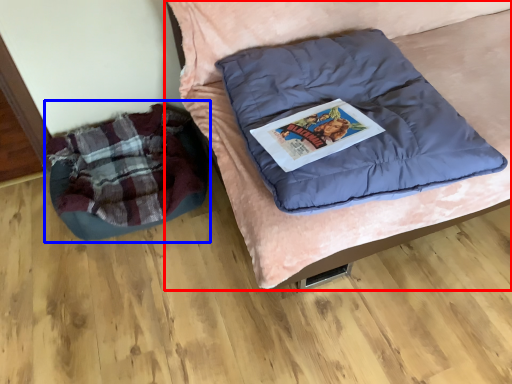
Question: Which object is further to the camera taking this photo, furniture (highlighted by a red box) or bean bag chair (highlighted by a blue box)?

Choices:
 (A) furniture
 (B) bean bag chair

Answer: (B)